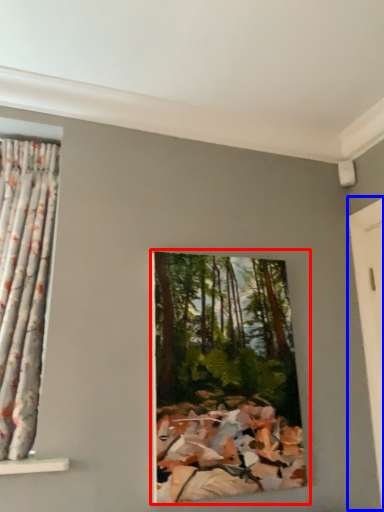
Question: Which object is closer to the camera taking this photo, oil painting (highlighted by a red box) or door (highlighted by a blue box)?

Choices:
 (A) oil painting
 (B) door

Answer: (A)